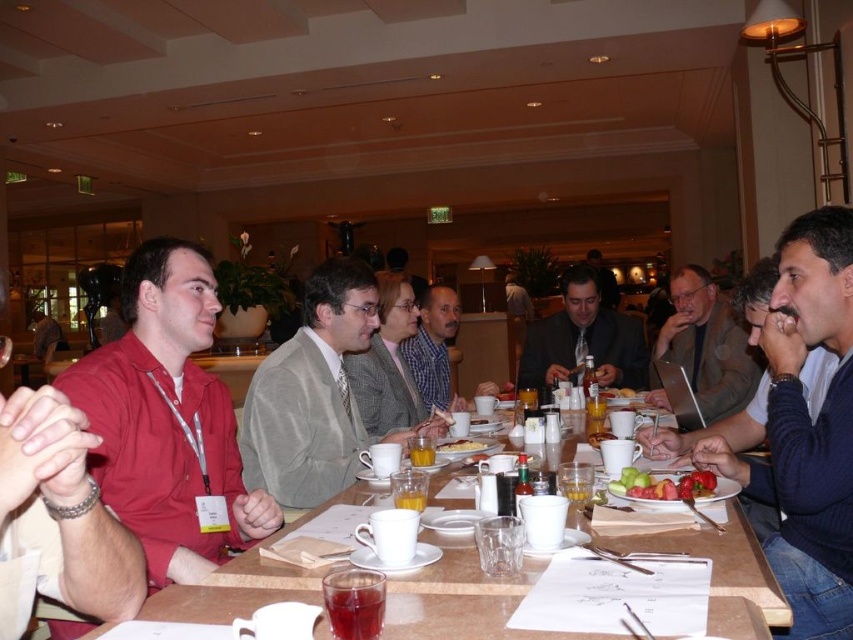
Question: Which point is closer to the camera taking this photo?

Choices:
 (A) (630, 396)
 (B) (160, 342)

Answer: (B)

Question: Estimate the real-world distances between objects in this image. Which object is farther from the matte gray suit at center?

Choices:
 (A) light gray suit at center
 (B) shiny plastic plate at center
 (C) matte red shirt at left

Answer: (B)

Question: Is gray wool suit at center above smooth white plate at center?

Choices:
 (A) no
 (B) yes

Answer: (B)

Question: From the image, what is the correct spatial relationship of blue plaid shirt at center in relation to shiny plastic plate at center?

Choices:
 (A) right
 (B) left

Answer: (B)

Question: Can you confirm if matte gray suit at center is positioned below shiny plastic plate at center?

Choices:
 (A) no
 (B) yes

Answer: (A)

Question: Among these objects, which one is nearest to the camera?

Choices:
 (A) smooth white plate at center
 (B) green leafy salad at center
 (C) matte gray suit at center
 (D) shiny plastic plate at center

Answer: (D)